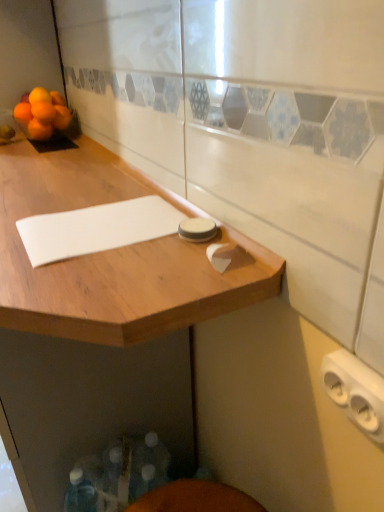
Where is `free spot behind white matte notepad at center`? This screenshot has width=384, height=512. free spot behind white matte notepad at center is located at coordinates pos(84,192).